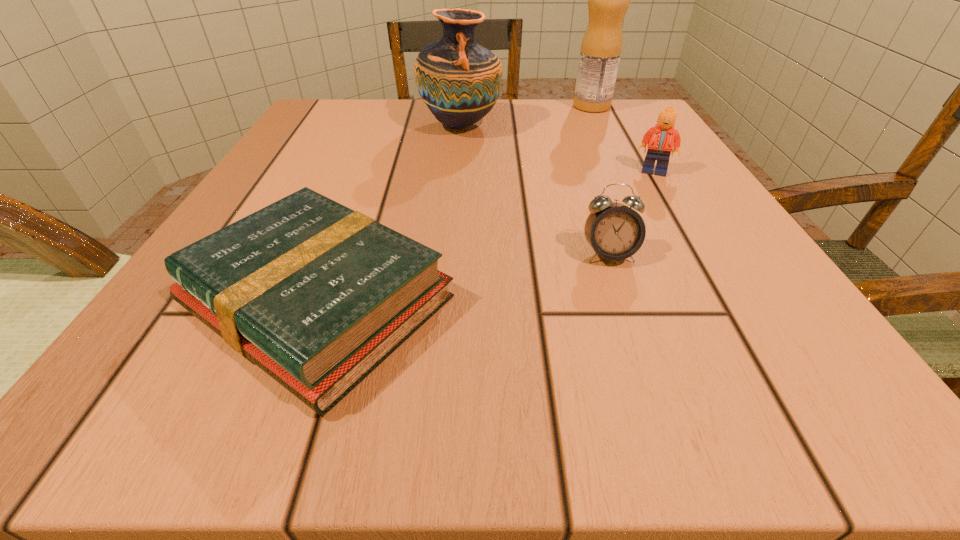
Find the location of a particular element. empty location between the shortest object and the pottery is located at coordinates (389, 213).

Locate an element on the screen. free spot between the shortest object and the fourth tallest object is located at coordinates (463, 278).

Where is `free space between the second shortest object and the shortest object`? This screenshot has width=960, height=540. free space between the second shortest object and the shortest object is located at coordinates (463, 278).

Where is `vacant area that lies between the alarm clock and the shortest object`? Image resolution: width=960 pixels, height=540 pixels. vacant area that lies between the alarm clock and the shortest object is located at coordinates pyautogui.click(x=463, y=278).

In order to click on empty location between the tallest object and the shortest object in this screenshot , I will do `click(455, 204)`.

Where is `free point between the Lego and the fruit juice`? free point between the Lego and the fruit juice is located at coordinates (623, 139).

At what (x,y) coordinates should I click in order to perform the action: click on free point between the shortest object and the pottery. Please return your answer as a coordinate pair (x, y). This screenshot has width=960, height=540. Looking at the image, I should click on (389, 213).

Find the location of a particular element. The height and width of the screenshot is (540, 960). object that can be found as the second closest to the second tallest object is located at coordinates (660, 138).

Image resolution: width=960 pixels, height=540 pixels. I want to click on object that is the closest to the Lego, so click(x=615, y=231).

I want to click on free spot that satisfies the following two spatial constraints: 1. on the front label of the tallest object; 2. on the face of the alarm clock, so click(664, 254).